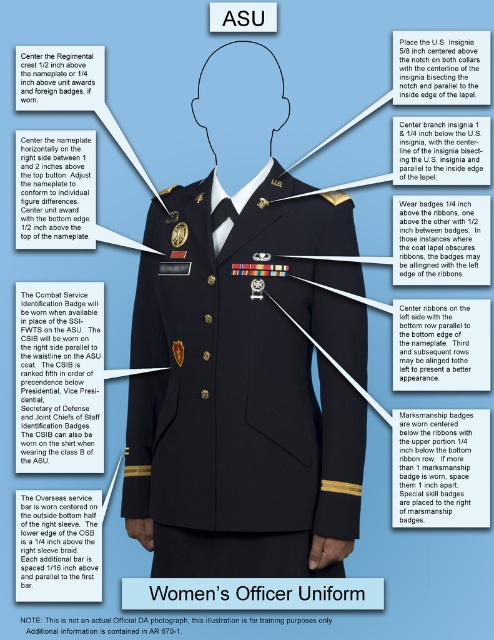
Looking at the Women Officer Uniform illustration, where is the navy blue wool jacket at center in relation to the us insignia at upper center?

The navy blue wool jacket at center is below the us insignia at upper center.